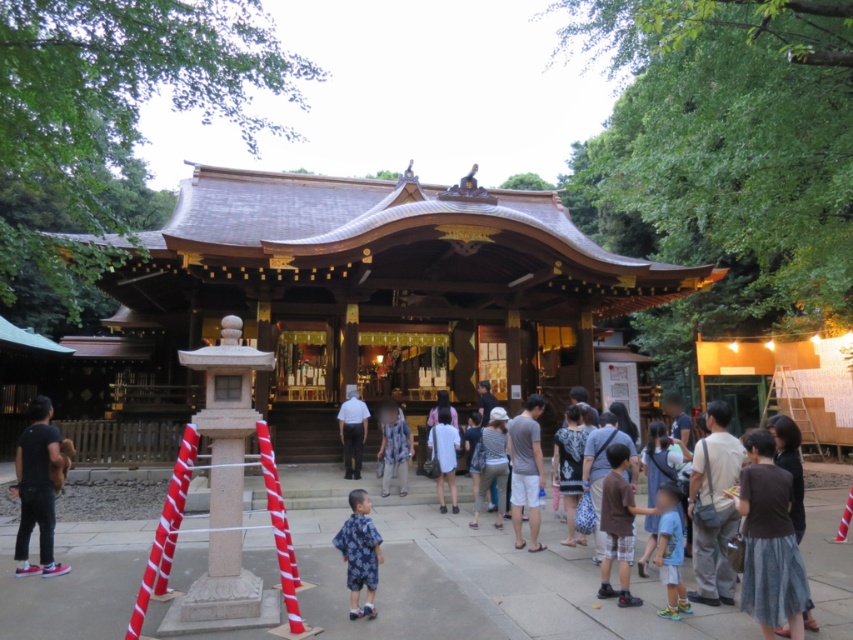
Does blue printed shirt at lower center appear on the right side of white cotton shirt at center?

Yes, blue printed shirt at lower center is to the right of white cotton shirt at center.

Between blue printed shirt at lower center and white cotton shirt at center, which one appears on the right side from the viewer's perspective?

From the viewer's perspective, blue printed shirt at lower center appears more on the right side.

Locate an element on the screen. Image resolution: width=853 pixels, height=640 pixels. blue printed shirt at lower center is located at coordinates (358, 552).

Identify the location of blue printed shirt at lower center. This screenshot has width=853, height=640. (358, 552).

Based on the photo, does blue printed shirt at lower center come behind blue plaid shirt at center?

That is False.

What are the coordinates of `blue printed shirt at lower center` in the screenshot? It's located at (358, 552).

Looking at this image, who is more forward, (351, 534) or (405, 449)?

Point (351, 534)

Identify the location of blue printed shirt at lower center. This screenshot has height=640, width=853. (358, 552).

Which is below, dark gray fabric pants at lower left or white cotton shirt at center?

white cotton shirt at center is lower down.

Does dark gray fabric pants at lower left have a greater width compared to white cotton shirt at center?

Yes, dark gray fabric pants at lower left is wider than white cotton shirt at center.

Where is `dark gray fabric pants at lower left`? dark gray fabric pants at lower left is located at coordinates (36, 488).